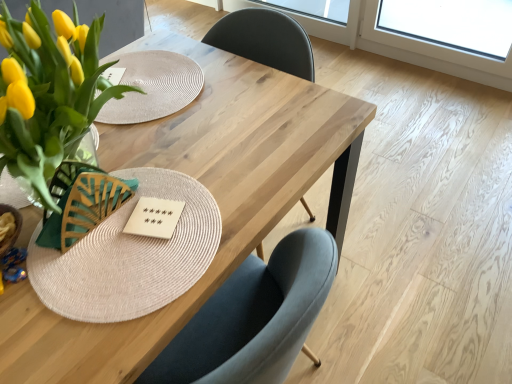
Question: Is natural wood table at center far away from wooden card game at center?

Choices:
 (A) no
 (B) yes

Answer: (A)

Question: Is natural wood table at center completely or partially outside of wooden card game at center?

Choices:
 (A) yes
 (B) no

Answer: (A)

Question: Is natural wood table at center in contact with wooden card game at center?

Choices:
 (A) no
 (B) yes

Answer: (A)

Question: From the image's perspective, is natural wood table at center beneath wooden card game at center?

Choices:
 (A) no
 (B) yes

Answer: (B)

Question: Is natural wood table at center thinner than wooden card game at center?

Choices:
 (A) yes
 (B) no

Answer: (B)

Question: Relative to transparent glass window screen at upper center, is natural wood table at center in front or behind?

Choices:
 (A) front
 (B) behind

Answer: (A)

Question: Is natural wood table at center to the left or to the right of transparent glass window screen at upper center in the image?

Choices:
 (A) right
 (B) left

Answer: (B)

Question: In terms of width, does natural wood table at center look wider or thinner when compared to transparent glass window screen at upper center?

Choices:
 (A) thin
 (B) wide

Answer: (B)

Question: Considering the positions of natural wood table at center and transparent glass window screen at upper center in the image, is natural wood table at center taller or shorter than transparent glass window screen at upper center?

Choices:
 (A) short
 (B) tall

Answer: (B)

Question: Choose the correct answer: Is wooden card game at center inside transparent glass window screen at upper center or outside it?

Choices:
 (A) outside
 (B) inside

Answer: (A)

Question: Does point (173, 211) appear closer or farther from the camera than point (323, 13)?

Choices:
 (A) closer
 (B) farther

Answer: (A)

Question: From the image's perspective, relative to transparent glass window screen at upper center, is wooden card game at center above or below?

Choices:
 (A) below
 (B) above

Answer: (A)

Question: From a real-world perspective, relative to transparent glass window screen at upper center, is wooden card game at center vertically above or below?

Choices:
 (A) below
 (B) above

Answer: (B)

Question: Is matte glass vase with yellow tulips at left spatially inside natural wood table at center, or outside of it?

Choices:
 (A) outside
 (B) inside

Answer: (A)

Question: In the image, is matte glass vase with yellow tulips at left on the left side or the right side of natural wood table at center?

Choices:
 (A) right
 (B) left

Answer: (B)